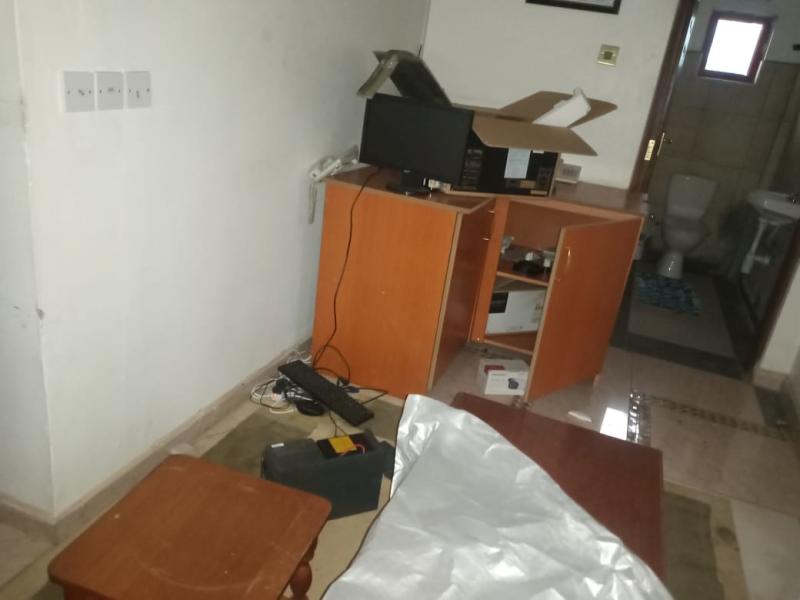
Where is `cabinent`? cabinent is located at coordinates (426, 257).